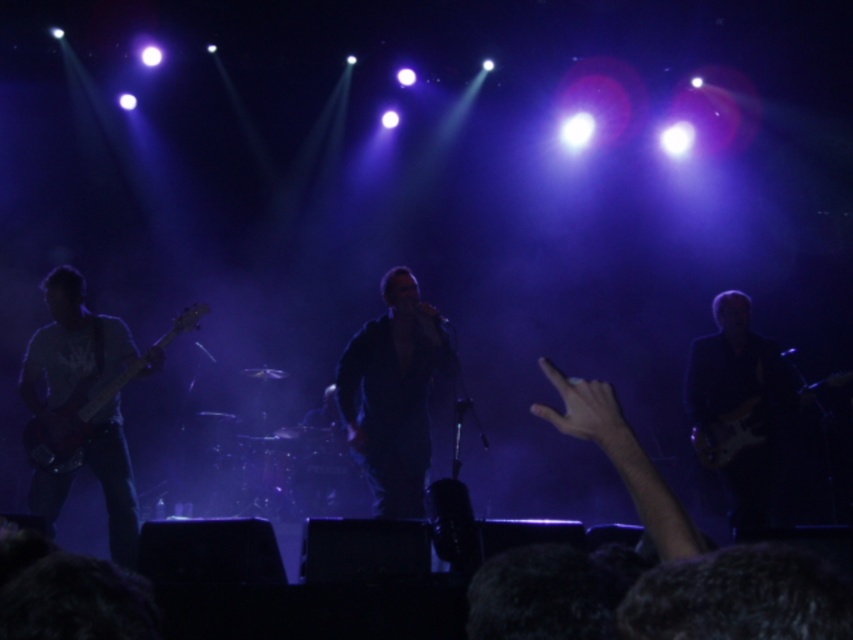
Question: Does black matte guitar at right appear under matte black guitar at left?

Choices:
 (A) yes
 (B) no

Answer: (A)

Question: Which point is farther to the camera?

Choices:
 (A) dark blue leather jacket at center
 (B) black matte guitar at right
 (C) matte white guitar at left
 (D) matte black electric guitar at right

Answer: (D)

Question: Which of the following is the closest to the observer?

Choices:
 (A) black matte guitar at right
 (B) dark blue leather jacket at center

Answer: (B)

Question: Is matte white guitar at left above matte black electric guitar at right?

Choices:
 (A) no
 (B) yes

Answer: (B)

Question: Is matte white guitar at left smaller than matte black electric guitar at right?

Choices:
 (A) no
 (B) yes

Answer: (A)

Question: Considering the real-world distances, which object is farthest from the black matte guitar at right?

Choices:
 (A) matte black electric guitar at right
 (B) dark blue leather jacket at center
 (C) matte black guitar at left
 (D) matte white guitar at left

Answer: (D)